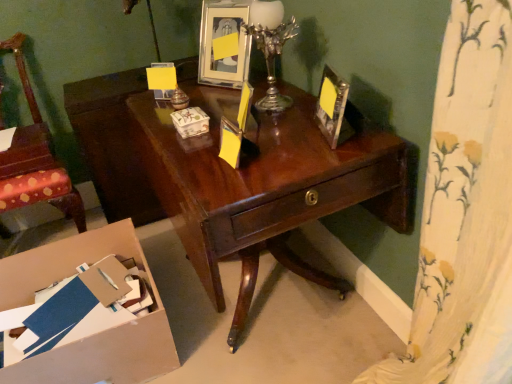
You are a GUI agent. You are given a task and a screenshot of the screen. Output one action in this format:
    pyautogui.click(x=<x>, y=<y>)
    Task: Click on the unoccupied area in front of metallic silver picture frame at upper center, the first picture frame when ordered from top to bottom
    The width and height of the screenshot is (512, 384).
    Given the screenshot: What is the action you would take?
    pyautogui.click(x=222, y=97)